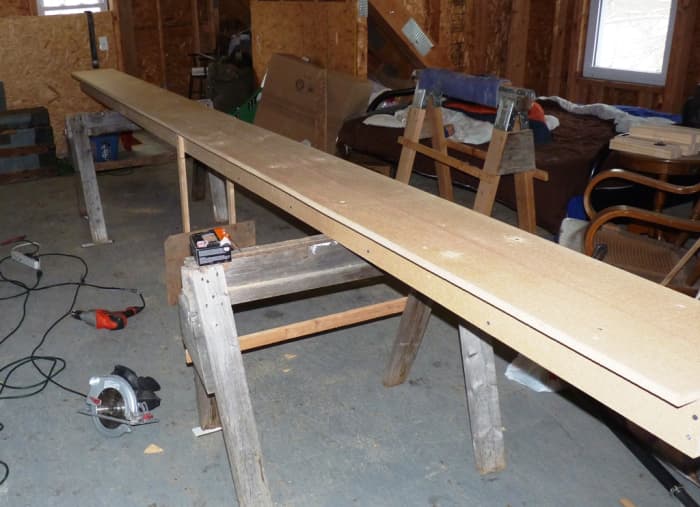
The height and width of the screenshot is (507, 700). What are the coordinates of `cord` in the screenshot? It's located at (41, 370).